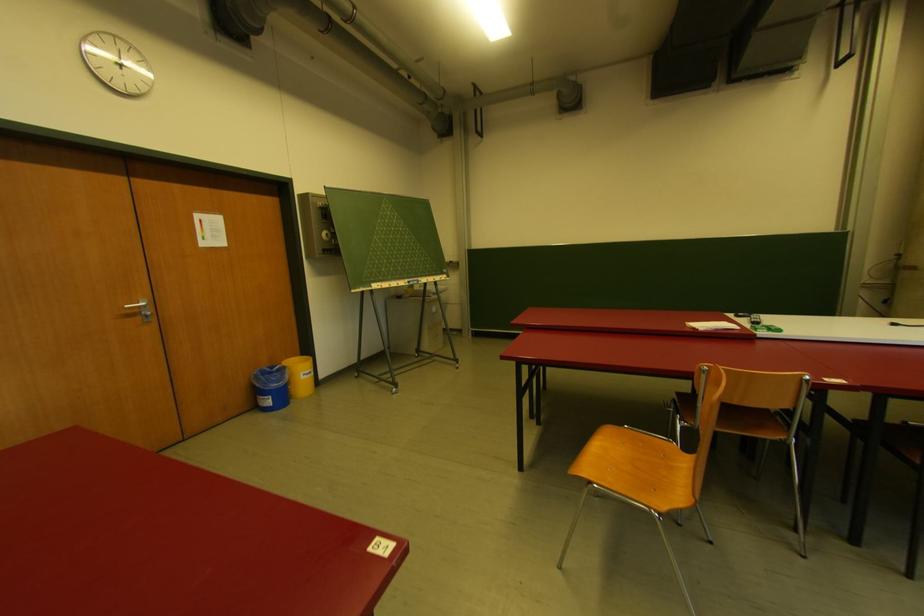
Find where to roll the black easel wheel. Please return your answer as a coordinate pair (x, y).

(237, 20)